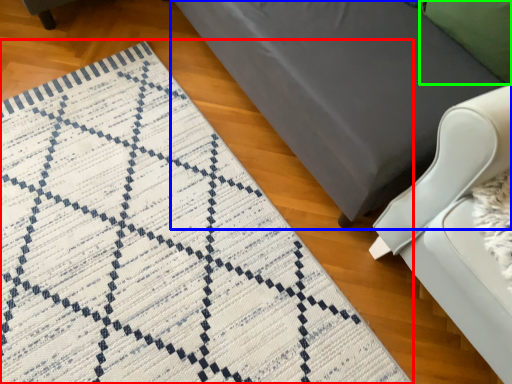
Question: Based on their relative distances, which object is nearer to mat (highlighted by a red box)? Choose from furniture (highlighted by a blue box) and pillow (highlighted by a green box).

Choices:
 (A) furniture
 (B) pillow

Answer: (A)